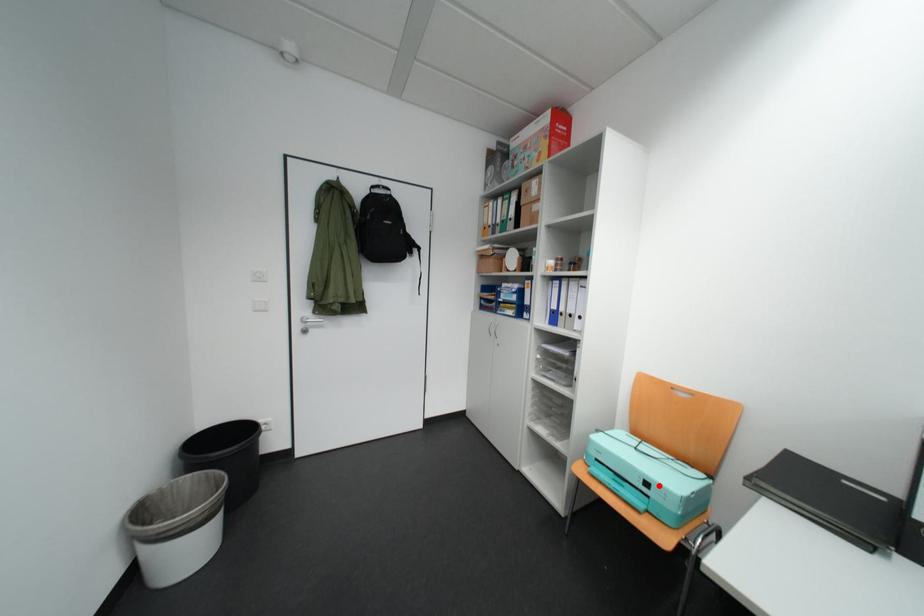
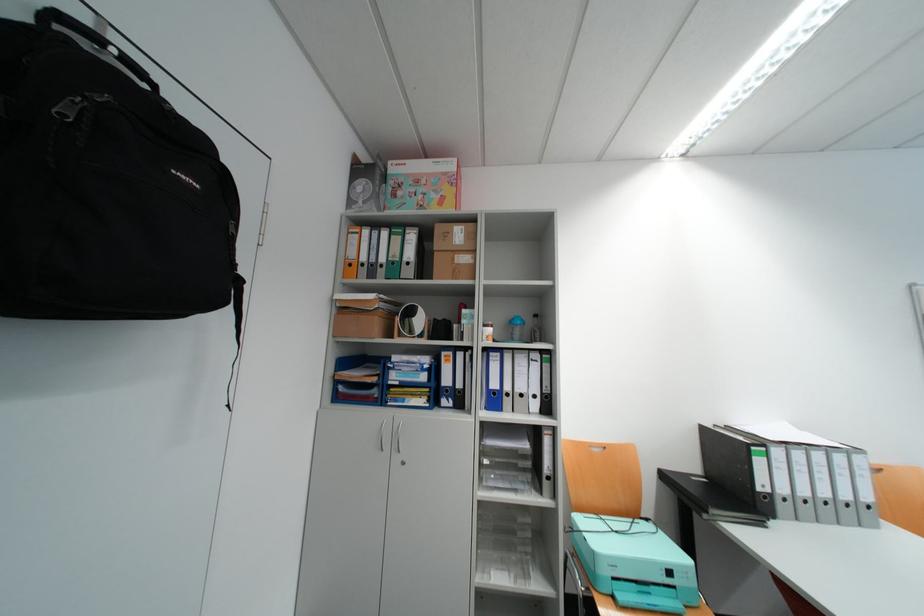
Question: A red point is marked in image1. In image2, is the corresponding 3D point closer to the camera or farther? Reply with the corresponding letter.

Choices:
 (A) The corresponding 3D point is closer.
 (B) The corresponding 3D point is farther.

Answer: (A)